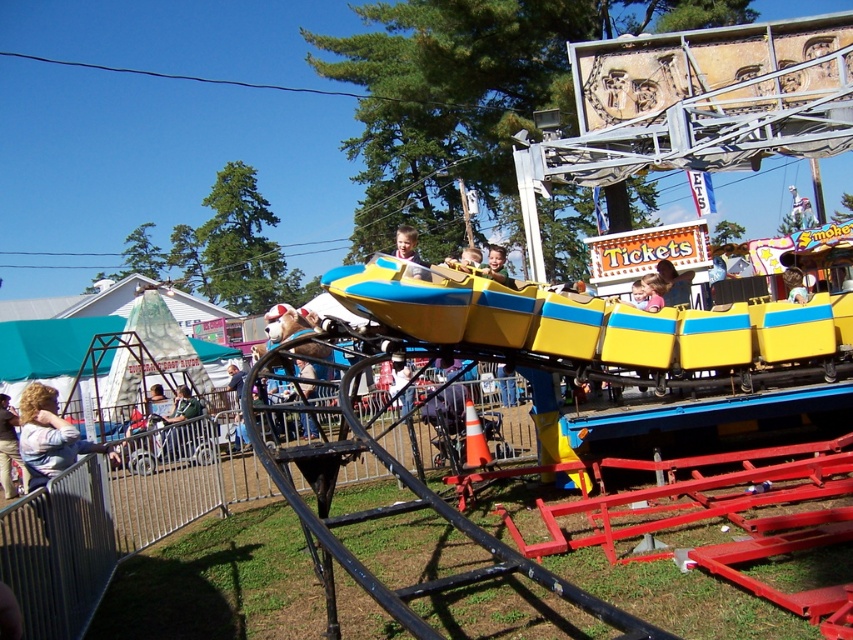
Which is in front, point (570, 301) or point (169, 428)?

Point (570, 301) is more forward.

Who is taller, yellow plastic roller coaster at center or green fabric jacket at center?

With more height is yellow plastic roller coaster at center.

At what (x,y) coordinates should I click in order to perform the action: click on yellow plastic roller coaster at center. Please return your answer as a coordinate pair (x, y). Looking at the image, I should click on (595, 323).

At what (x,y) coordinates should I click in order to perform the action: click on yellow plastic roller coaster at center. Please return your answer as a coordinate pair (x, y). This screenshot has height=640, width=853. Looking at the image, I should click on (595, 323).

In the scene shown: Is green fabric jacket at center bigger than smooth yellow helmet at center?

No.

Between point (171, 416) and point (395, 243), which one is positioned in front?

Point (171, 416) is in front.

At what (x,y) coordinates should I click in order to perform the action: click on green fabric jacket at center. Please return your answer as a coordinate pair (x, y). This screenshot has width=853, height=640. Looking at the image, I should click on (178, 438).

Which is in front, point (811, 248) or point (503, 273)?

Point (503, 273)

Is yellow plastic roller coaster at center in front of yellow plastic helmet at center?

Yes, yellow plastic roller coaster at center is closer to the viewer.

Between point (611, 358) and point (486, 266), which one is positioned behind?

Point (486, 266)

Find the location of a particular element. Image resolution: width=853 pixels, height=640 pixels. yellow plastic roller coaster at center is located at coordinates (595, 323).